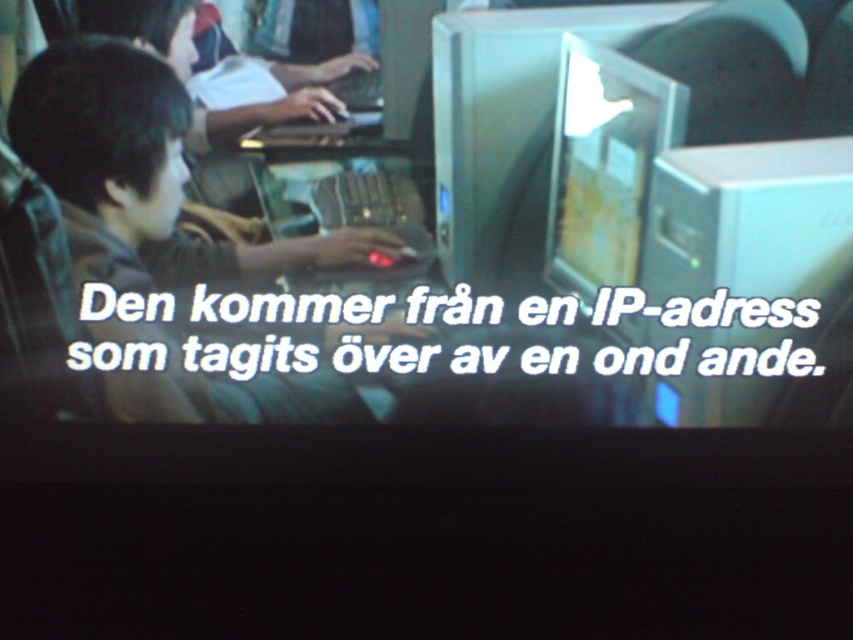
From the picture: Based on the scene description, where is the metallic silver computer monitor at center located in terms of coordinates?

The metallic silver computer monitor at center is located at point coordinates of (508,129).

You are setting up a presentation and need to connect a new projector to the metallic silver computer monitor at center and the matte black monitor at center. According to the image, which monitor should you connect first if you want to follow the left to right setup convention?

The metallic silver computer monitor at center should be connected first because it is positioned on the left side of the matte black monitor at center, following the left to right setup convention.